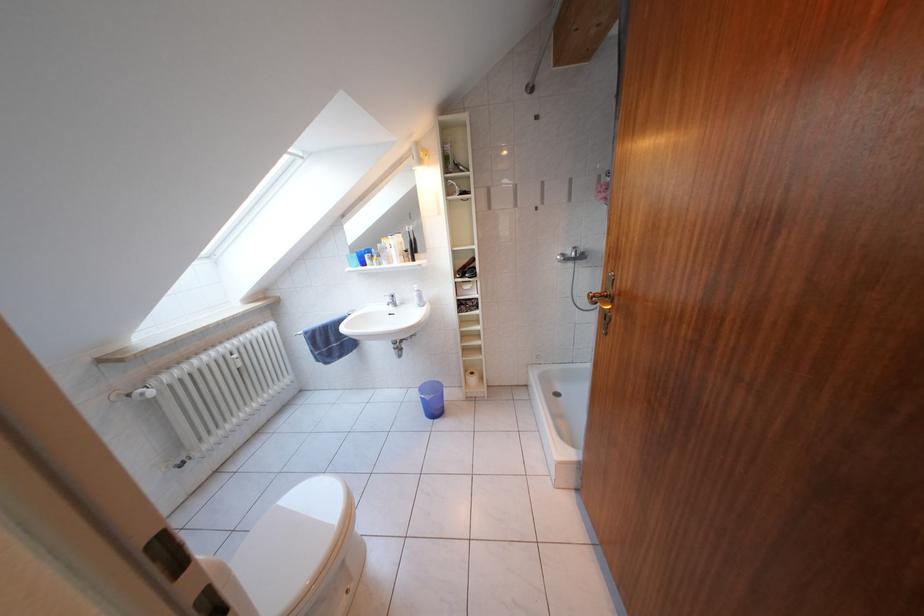
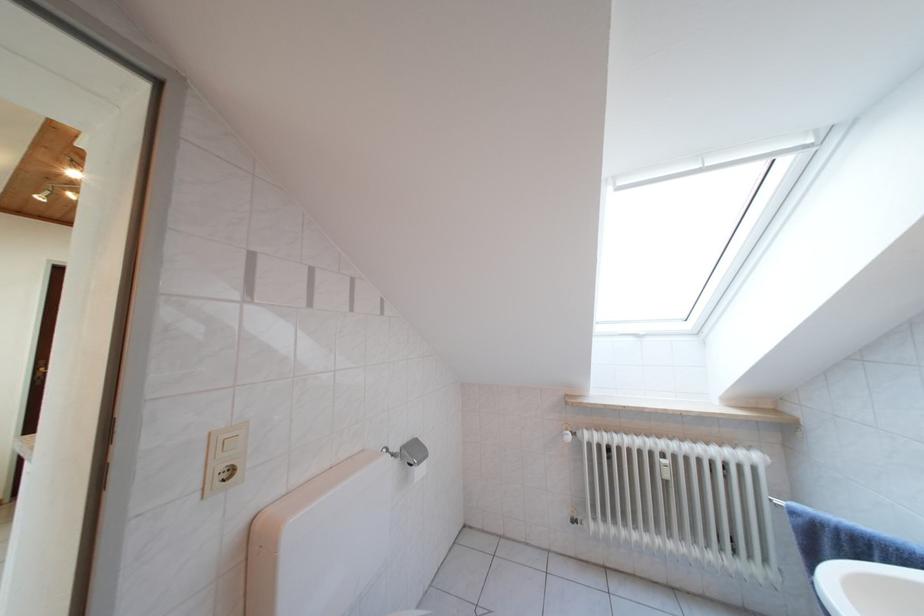
Locate, in the second image, the point that corresponds to point (161, 389) in the first image.

(588, 439)